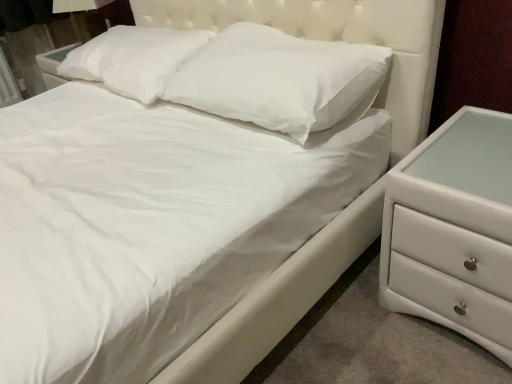
Question: In terms of size, does white soft pillow at center, positioned as the 2th pillow in left-to-right order, appear bigger or smaller than white glossy chest of drawers at right?

Choices:
 (A) big
 (B) small

Answer: (B)

Question: Would you say white soft pillow at center, the first pillow when ordered from right to left, is to the left or to the right of white glossy chest of drawers at right in the picture?

Choices:
 (A) left
 (B) right

Answer: (A)

Question: Which object is the closest to the white glossy chest of drawers at right?

Choices:
 (A) white soft pillow at center, the first pillow when ordered from right to left
 (B) white soft pillow at upper center, acting as the 1th pillow starting from the left

Answer: (A)

Question: Which object is the closest to the white soft pillow at upper center, acting as the 1th pillow starting from the left?

Choices:
 (A) white soft pillow at center, the first pillow when ordered from right to left
 (B) white glossy chest of drawers at right

Answer: (A)